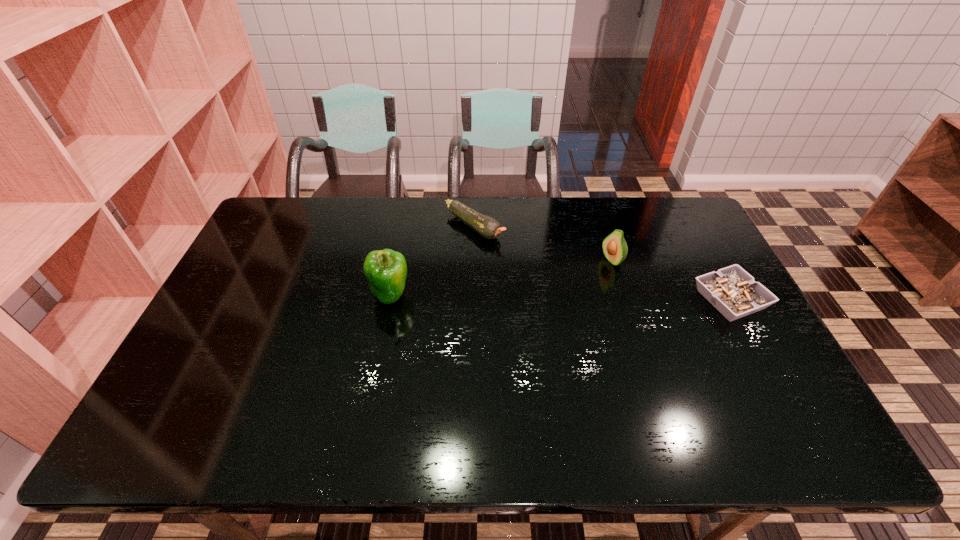
At what (x,y) coordinates should I click in order to perform the action: click on the tallest object. Please return your answer as a coordinate pair (x, y). Looking at the image, I should click on (386, 270).

At what (x,y) coordinates should I click in order to perform the action: click on the leftmost object. Please return your answer as a coordinate pair (x, y). Looking at the image, I should click on (386, 270).

Where is `the rightmost object`? Image resolution: width=960 pixels, height=540 pixels. the rightmost object is located at coordinates (731, 290).

At what (x,y) coordinates should I click in order to perform the action: click on ashtray. Please return your answer as a coordinate pair (x, y). Looking at the image, I should click on (731, 290).

You are a GUI agent. You are given a task and a screenshot of the screen. Output one action in this format:
    pyautogui.click(x=<x>, y=<y>)
    Task: Click on the second object from right to left
    The image size is (960, 540).
    Given the screenshot: What is the action you would take?
    pyautogui.click(x=614, y=246)

Image resolution: width=960 pixels, height=540 pixels. In order to click on the third shortest object in this screenshot , I will do coord(614,246).

Identify the location of the third tallest object. (489, 228).

Find the location of a particular element. the farthest object is located at coordinates (489, 228).

Where is `free space located on the back of the leftmost object`? free space located on the back of the leftmost object is located at coordinates (397, 256).

Where is `free space located 0.160m on the front of the ashtray`? This screenshot has width=960, height=540. free space located 0.160m on the front of the ashtray is located at coordinates (772, 377).